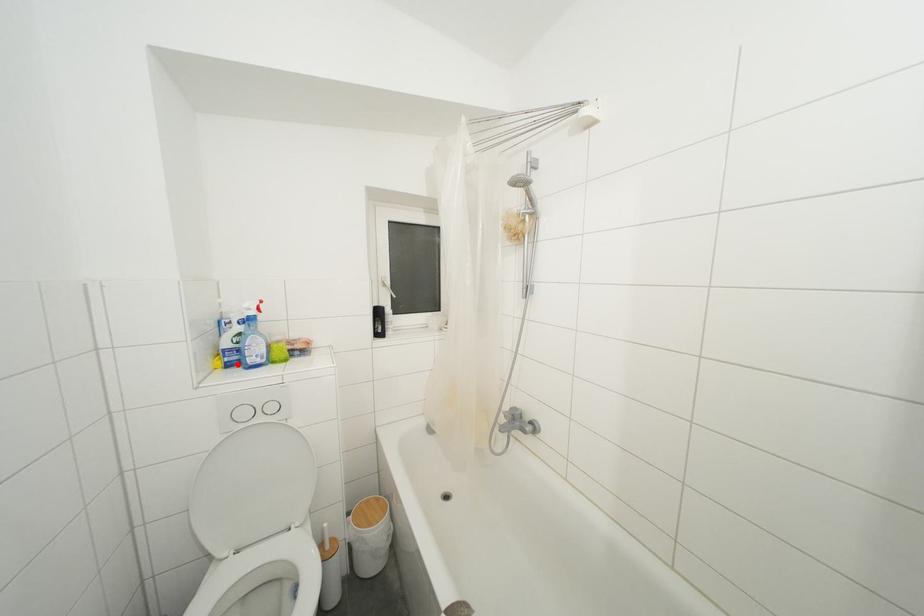
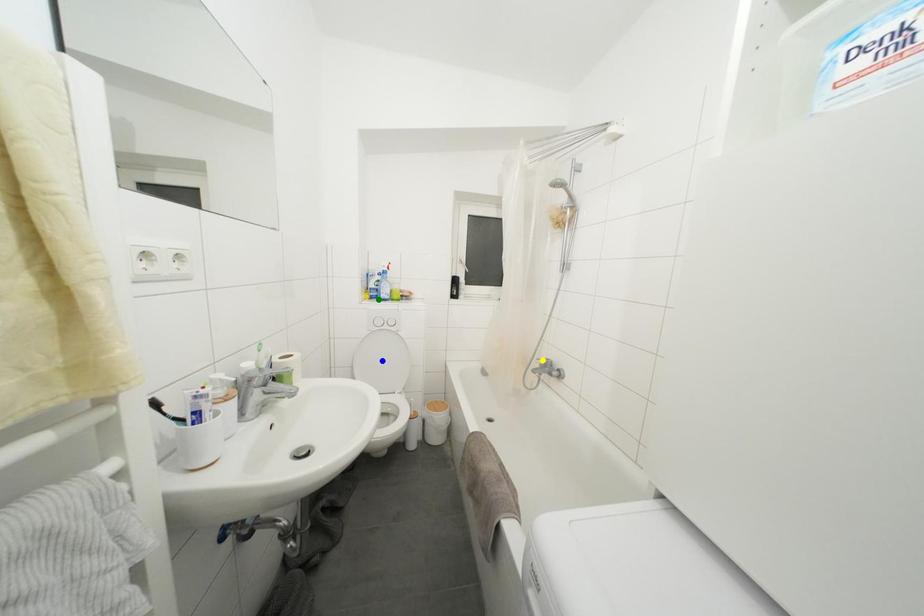
Question: I am providing you with two images of the same scene from different viewpoints. A red point is marked on the first image. You are given multiple points on the second image. Can you choose the point in image 2 that corresponds to the point in image 1?

Choices:
 (A) yellow point
 (B) green point
 (C) blue point

Answer: (B)